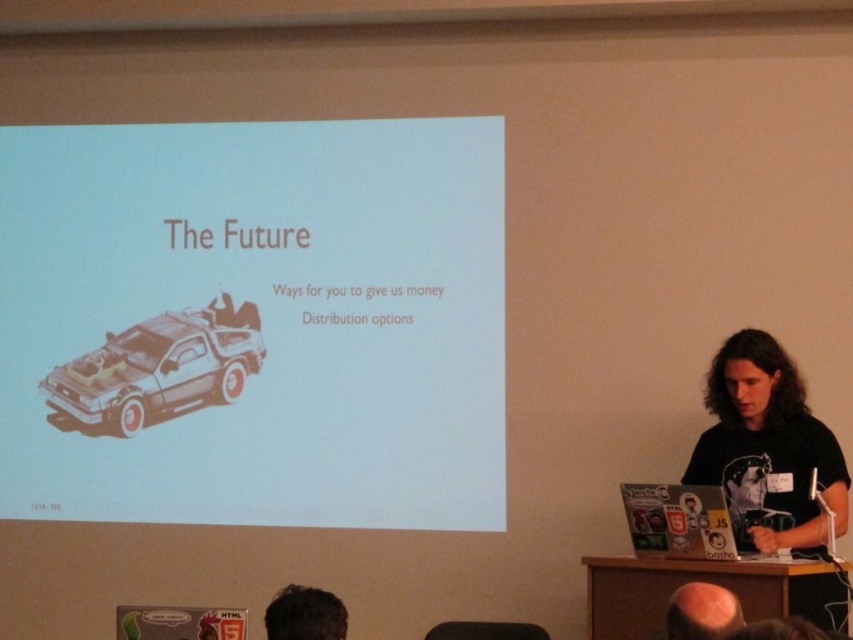
Question: Which object is farther from the camera taking this photo?

Choices:
 (A) metallic silver car at center
 (B) dark brown hair at lower left
 (C) smooth bald head at lower center

Answer: (A)

Question: Is the position of white paper at center more distant than that of metallic silver car at center?

Choices:
 (A) yes
 (B) no

Answer: (B)

Question: Which of these objects is positioned closest to the white paper at center?

Choices:
 (A) metallic silver car at center
 (B) smooth bald head at lower center
 (C) dark brown hair at lower left

Answer: (A)

Question: Is the position of metallic silver car at center less distant than that of smooth bald head at lower center?

Choices:
 (A) no
 (B) yes

Answer: (A)

Question: Observing the image, what is the correct spatial positioning of dark brown hair at lower left in reference to smooth bald head at lower center?

Choices:
 (A) below
 (B) above

Answer: (B)

Question: Estimate the real-world distances between objects in this image. Which object is farther from the smooth bald head at lower center?

Choices:
 (A) dark brown hair at lower left
 (B) white paper at center
 (C) metallic silver car at center

Answer: (C)